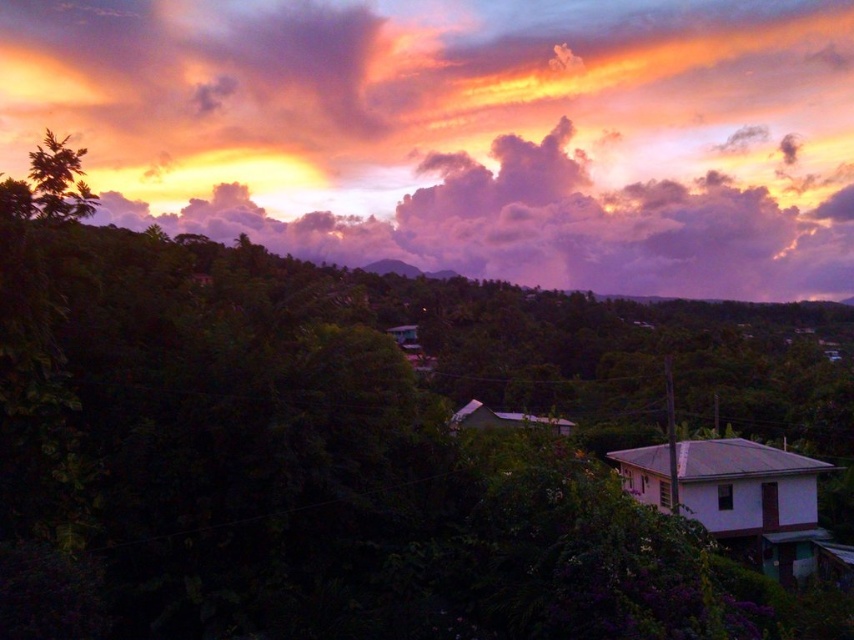
Does point (799, 189) come closer to viewer compared to point (65, 193)?

No, (799, 189) is behind (65, 193).

Which is in front, point (50, 76) or point (37, 193)?

Point (37, 193) is more forward.

Locate an element on the screen. purple cotton candy cloud at upper center is located at coordinates (465, 131).

Identify the location of purple cotton candy cloud at upper center. Image resolution: width=854 pixels, height=640 pixels. (465, 131).